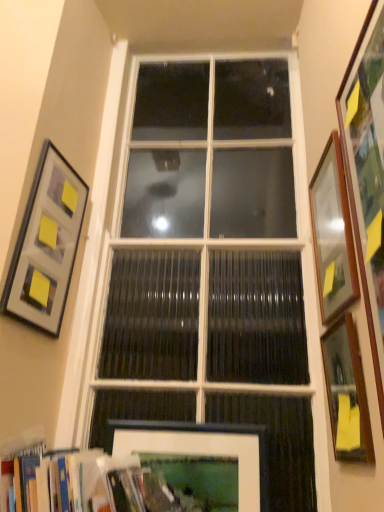
Question: Considering the relative sizes of wooden bookshelf at lower left and matte gray picture frame at upper left, arranged as the 5th picture frame when viewed from the right, in the image provided, is wooden bookshelf at lower left taller than matte gray picture frame at upper left, arranged as the 5th picture frame when viewed from the right,?

Choices:
 (A) no
 (B) yes

Answer: (A)

Question: Considering the relative sizes of wooden bookshelf at lower left and matte gray picture frame at upper left, the first picture frame positioned from the left, in the image provided, is wooden bookshelf at lower left bigger than matte gray picture frame at upper left, the first picture frame positioned from the left,?

Choices:
 (A) no
 (B) yes

Answer: (B)

Question: From the image's perspective, does wooden bookshelf at lower left appear lower than matte gray picture frame at upper left, arranged as the 5th picture frame when viewed from the right?

Choices:
 (A) yes
 (B) no

Answer: (A)

Question: Does wooden bookshelf at lower left touch matte gray picture frame at upper left, the first picture frame positioned from the left?

Choices:
 (A) yes
 (B) no

Answer: (B)

Question: Is wooden bookshelf at lower left positioned far away from matte gray picture frame at upper left, the first picture frame positioned from the left?

Choices:
 (A) no
 (B) yes

Answer: (A)

Question: Is matte gray picture frame at upper left, the first picture frame positioned from the left, at the back of wooden bookshelf at lower left?

Choices:
 (A) no
 (B) yes

Answer: (A)

Question: Is wooden framed mirror at right, the 2th picture frame viewed from the right, wider than wooden picture frame at right, arranged as the first picture frame when viewed from the right?

Choices:
 (A) yes
 (B) no

Answer: (A)

Question: From a real-world perspective, is wooden framed mirror at right, the fourth picture frame in the left-to-right sequence, on wooden picture frame at right, arranged as the first picture frame when viewed from the right?

Choices:
 (A) no
 (B) yes

Answer: (A)

Question: Is wooden framed mirror at right, the 2th picture frame viewed from the right, to the right of wooden picture frame at right, the 5th picture frame in the left-to-right sequence, from the viewer's perspective?

Choices:
 (A) yes
 (B) no

Answer: (B)

Question: From a real-world perspective, is wooden framed mirror at right, the fourth picture frame in the left-to-right sequence, positioned under wooden picture frame at right, arranged as the first picture frame when viewed from the right, based on gravity?

Choices:
 (A) no
 (B) yes

Answer: (B)

Question: Is wooden framed mirror at right, the fourth picture frame in the left-to-right sequence, thinner than wooden picture frame at right, arranged as the first picture frame when viewed from the right?

Choices:
 (A) no
 (B) yes

Answer: (A)

Question: From the image's perspective, is wooden framed mirror at right, the 2th picture frame viewed from the right, located beneath wooden picture frame at right, the 5th picture frame in the left-to-right sequence?

Choices:
 (A) yes
 (B) no

Answer: (A)

Question: Can you confirm if wooden bookshelf at lower left is taller than wooden framed mirror at right, the 2th picture frame viewed from the right?

Choices:
 (A) no
 (B) yes

Answer: (A)